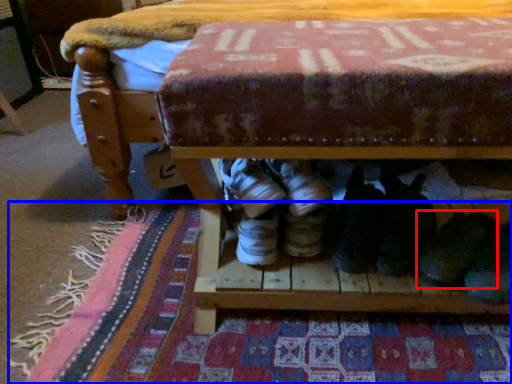
Question: Which object is further to the camera taking this photo, footwear (highlighted by a red box) or mat (highlighted by a blue box)?

Choices:
 (A) footwear
 (B) mat

Answer: (B)